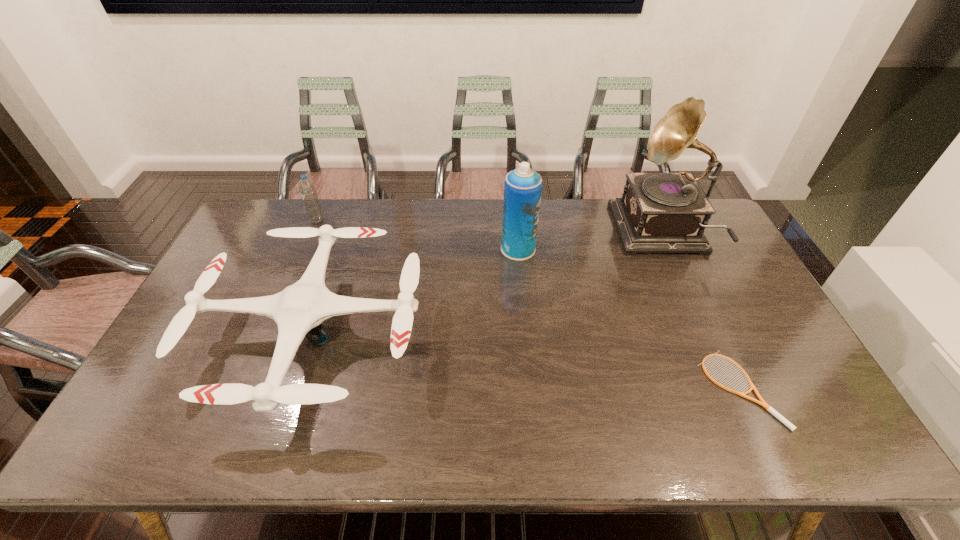
Find the location of `blank space located 0.160m on the right of the water bottle`. blank space located 0.160m on the right of the water bottle is located at coordinates (370, 221).

I want to click on vacant space located 0.350m with the camera attached at the bottom of the drone, so click(x=547, y=333).

The image size is (960, 540). Identify the location of free space located on the left of the tennis racket. pos(630,389).

Find the location of `record player that is positioned at the far edge`. record player that is positioned at the far edge is located at coordinates 659,212.

At what (x,y) coordinates should I click in order to perform the action: click on aerosol can at the far edge. Please return your answer as a coordinate pair (x, y). The height and width of the screenshot is (540, 960). Looking at the image, I should click on (523, 186).

At what (x,y) coordinates should I click in order to perform the action: click on water bottle at the far edge. Please return your answer as a coordinate pair (x, y). Looking at the image, I should click on (307, 188).

The width and height of the screenshot is (960, 540). In order to click on drone that is positioned at the near edge in this screenshot , I will do `click(299, 310)`.

At what (x,y) coordinates should I click in order to perform the action: click on tennis racket located in the near edge section of the desktop. Please return your answer as a coordinate pair (x, y). Image resolution: width=960 pixels, height=540 pixels. Looking at the image, I should click on (762, 403).

At what (x,y) coordinates should I click in order to perform the action: click on object that is at the left edge. Please return your answer as a coordinate pair (x, y). The image size is (960, 540). Looking at the image, I should click on (299, 310).

This screenshot has height=540, width=960. In order to click on record player that is at the right edge in this screenshot , I will do `click(659, 212)`.